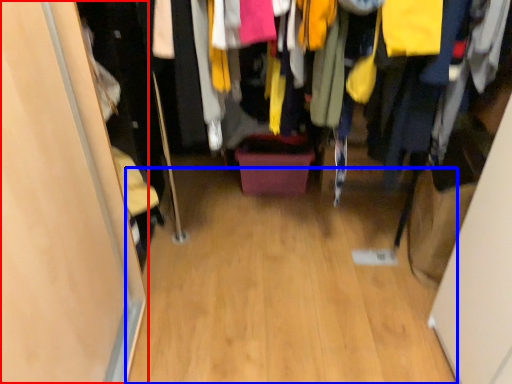
Question: Which point is further to the camera, door (highlighted by a red box) or plain (highlighted by a blue box)?

Choices:
 (A) door
 (B) plain

Answer: (B)